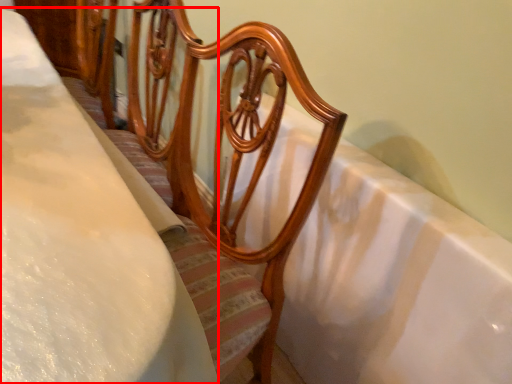
Question: Considering the relative positions of sheet (annotated by the red box) and bath in the image provided, where is sheet (annotated by the red box) located with respect to the staircase?

Choices:
 (A) left
 (B) right

Answer: (A)